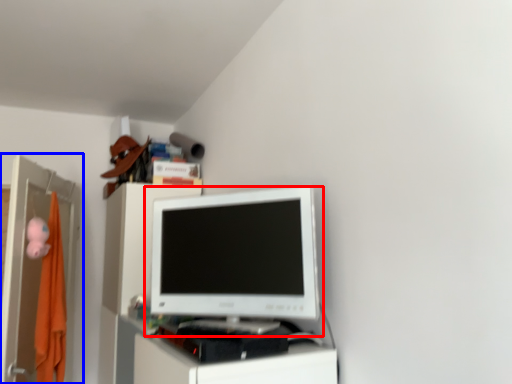
Question: Which of the following is the closest to the observer, computer monitor (highlighted by a red box) or file cabinet (highlighted by a blue box)?

Choices:
 (A) computer monitor
 (B) file cabinet

Answer: (A)